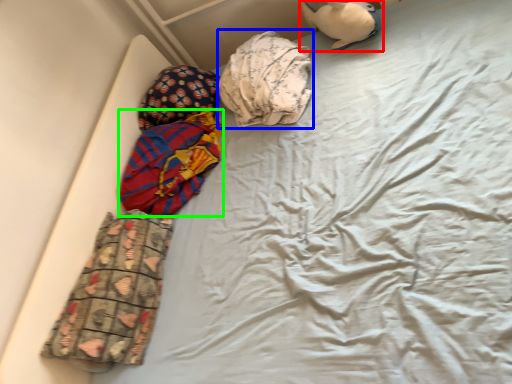
Question: Which object is positioned closest to toy (highlighted by a red box)? Select from material (highlighted by a blue box) and material (highlighted by a green box).

Choices:
 (A) material
 (B) material

Answer: (A)